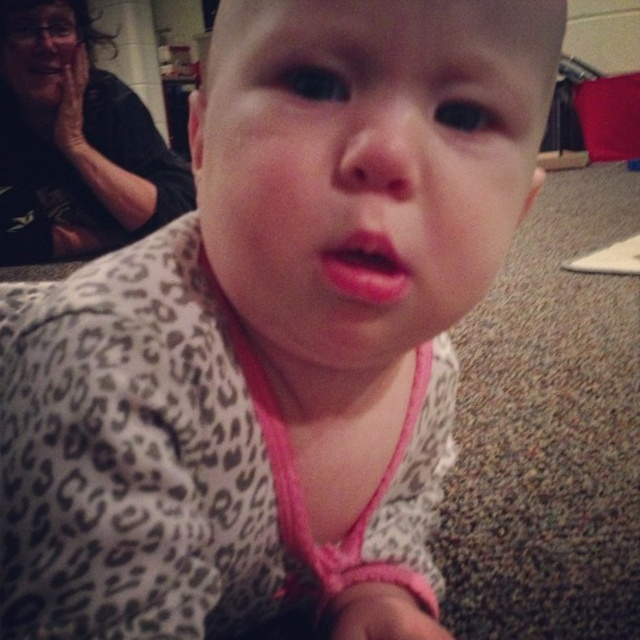
Between matte black shirt at upper left and pink matte lips at center, which one appears on the left side from the viewer's perspective?

matte black shirt at upper left

Can you confirm if matte black shirt at upper left is shorter than pink matte lips at center?

No.

Image resolution: width=640 pixels, height=640 pixels. What do you see at coordinates (74, 141) in the screenshot? I see `matte black shirt at upper left` at bounding box center [74, 141].

You are a GUI agent. You are given a task and a screenshot of the screen. Output one action in this format:
    pyautogui.click(x=<x>, y=<y>)
    Task: Click on the matte black shirt at upper left
    This screenshot has height=640, width=640.
    Given the screenshot: What is the action you would take?
    pyautogui.click(x=74, y=141)